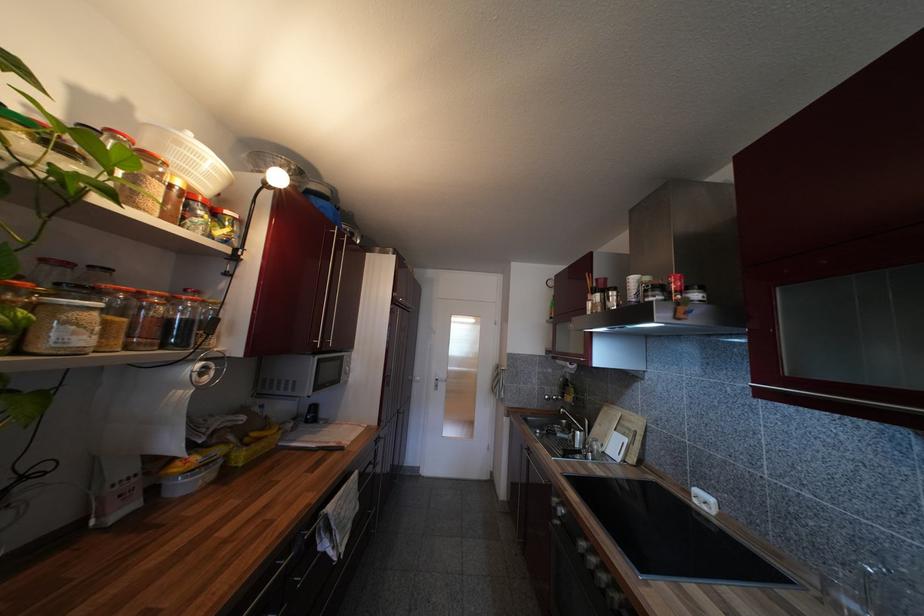
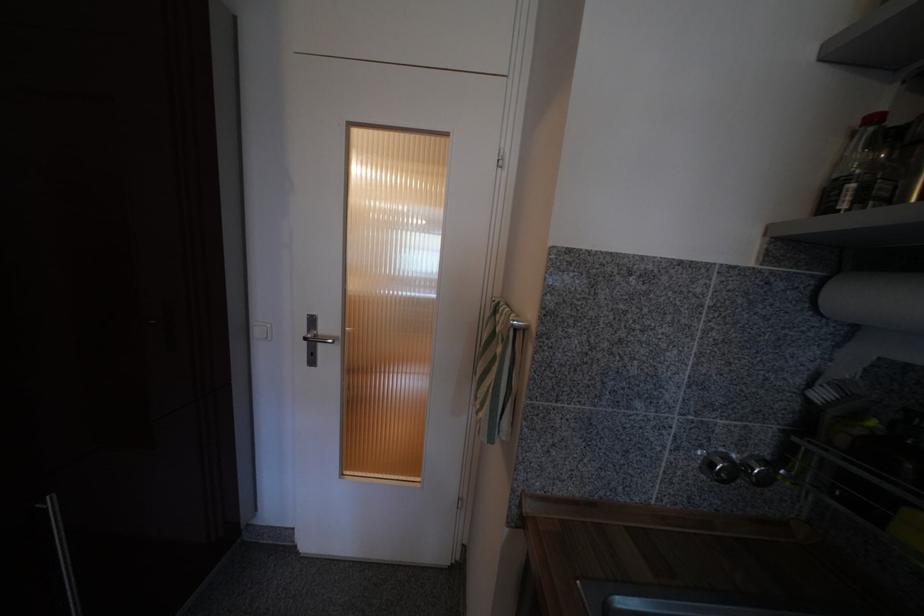
Locate, in the second image, the point that corresponds to the point at 553,398 in the first image.

(730, 460)